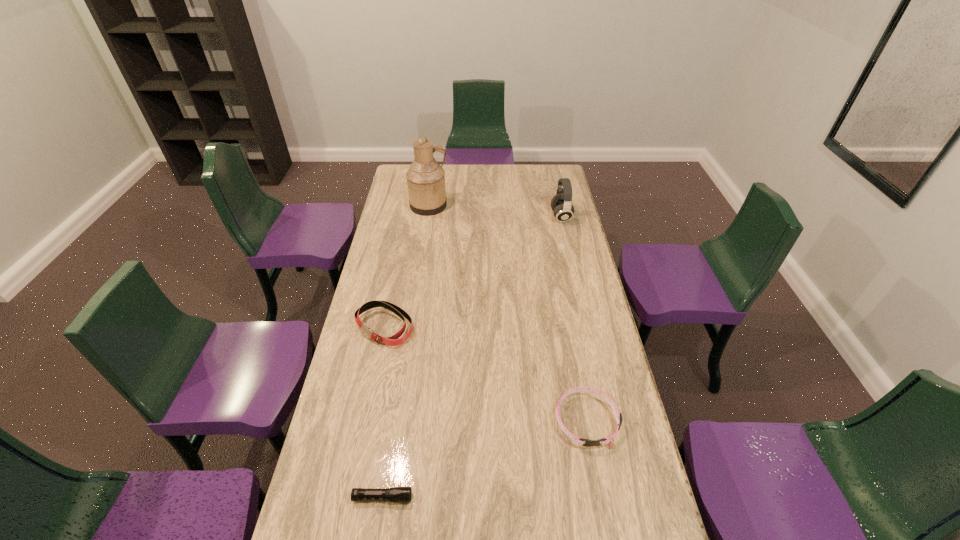
Locate an element on the screen. the tallest object is located at coordinates [425, 178].

This screenshot has height=540, width=960. I want to click on the fourth shortest object, so click(561, 204).

Image resolution: width=960 pixels, height=540 pixels. Identify the location of the third nearest object. (393, 340).

Locate an element on the screen. the left dog collar is located at coordinates (393, 340).

The height and width of the screenshot is (540, 960). I want to click on the fourth farthest object, so click(607, 440).

Where is `the shorter dog collar`? The image size is (960, 540). the shorter dog collar is located at coordinates (607, 440).

Where is `flashlight`? The height and width of the screenshot is (540, 960). flashlight is located at coordinates (394, 494).

Identify the location of the nearest object. (394, 494).

The width and height of the screenshot is (960, 540). What are the coordinates of `vacant region located 0.050m on the front of the pitcher` in the screenshot? It's located at (426, 222).

Locate an element on the screen. This screenshot has height=540, width=960. vacant space located on the ear cups of the fourth shortest object is located at coordinates (485, 217).